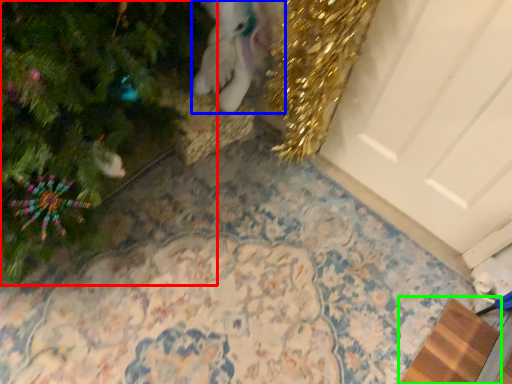
Question: Which object is the closest to the christmas tree (highlighted by a red box)? Choose among these: animal (highlighted by a blue box) or doormat (highlighted by a green box).

Choices:
 (A) animal
 (B) doormat

Answer: (A)